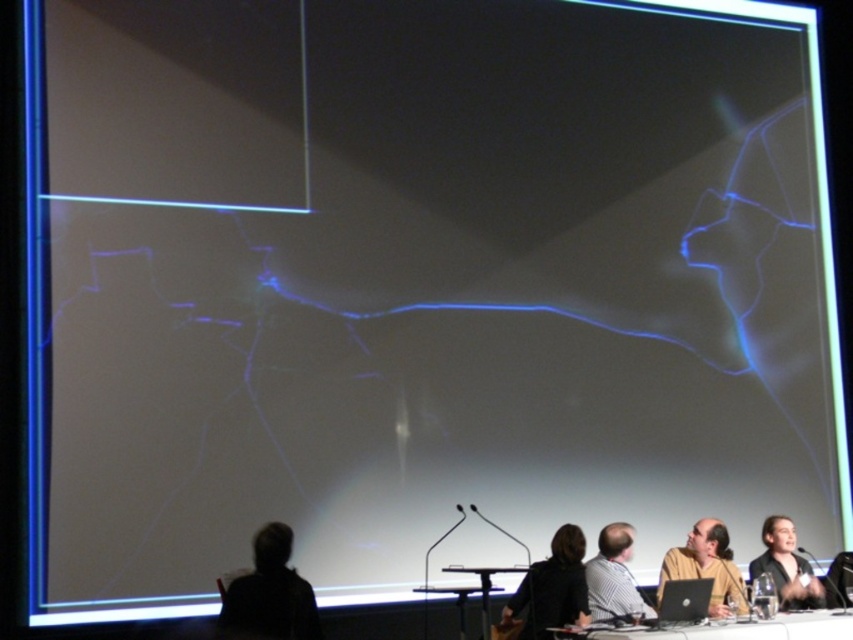
How far apart are black fabric person at lower center and black plastic table at lower center?

black fabric person at lower center and black plastic table at lower center are 20.00 inches apart.

Can you confirm if black fabric person at lower center is positioned to the right of black plastic table at lower center?

No, black fabric person at lower center is not to the right of black plastic table at lower center.

Between point (548, 600) and point (695, 625), which one is positioned in front?

Point (695, 625) is more forward.

Locate an element on the screen. black fabric person at lower center is located at coordinates (552, 588).

Is point (236, 602) more distant than point (662, 572)?

No, (236, 602) is in front of (662, 572).

The width and height of the screenshot is (853, 640). In order to click on silhouette hair at lower left in this screenshot , I will do `click(270, 595)`.

Who is more forward, (265, 618) or (672, 557)?

Point (265, 618)

Locate an element on the screen. The width and height of the screenshot is (853, 640). silhouette hair at lower left is located at coordinates (270, 595).

Can you confirm if matte brown shirt at lower right is smaller than striped fabric shirt at lower center?

Incorrect, matte brown shirt at lower right is not smaller in size than striped fabric shirt at lower center.

Between point (692, 566) and point (608, 538), which one is positioned in front?

Point (608, 538)

The image size is (853, 640). What are the coordinates of `matte brown shirt at lower right` in the screenshot? It's located at (706, 566).